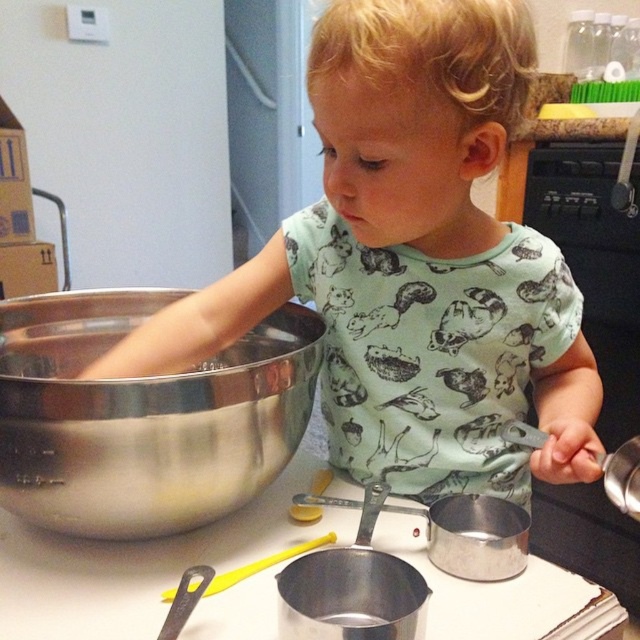
Who is taller, green printed shirt at center or shiny metallic bowl at center?

green printed shirt at center is taller.

Between point (451, 403) and point (184, 422), which one is positioned in front?

Point (184, 422)

Is point (461, 56) closer to viewer compared to point (273, 316)?

Yes, it is.

I want to click on green printed shirt at center, so click(413, 262).